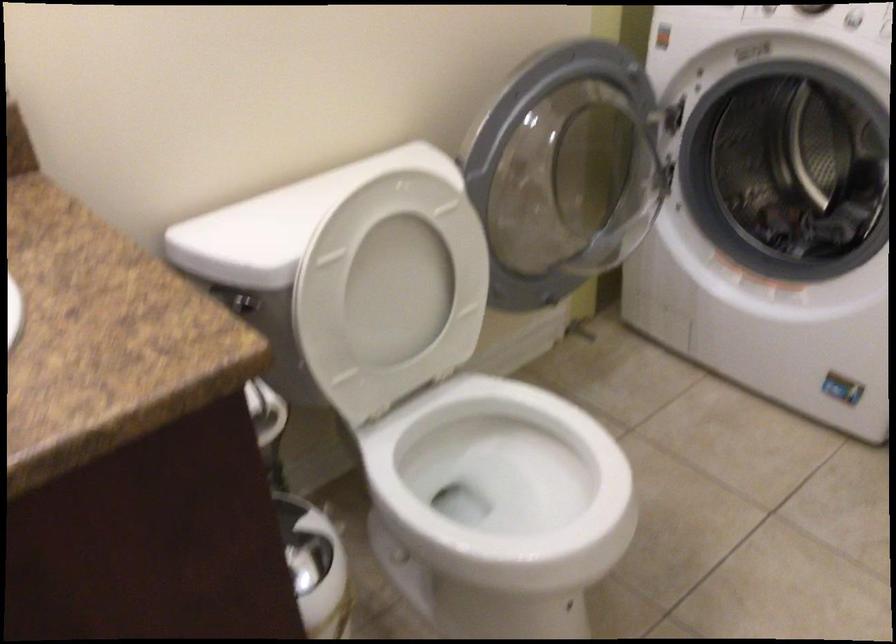
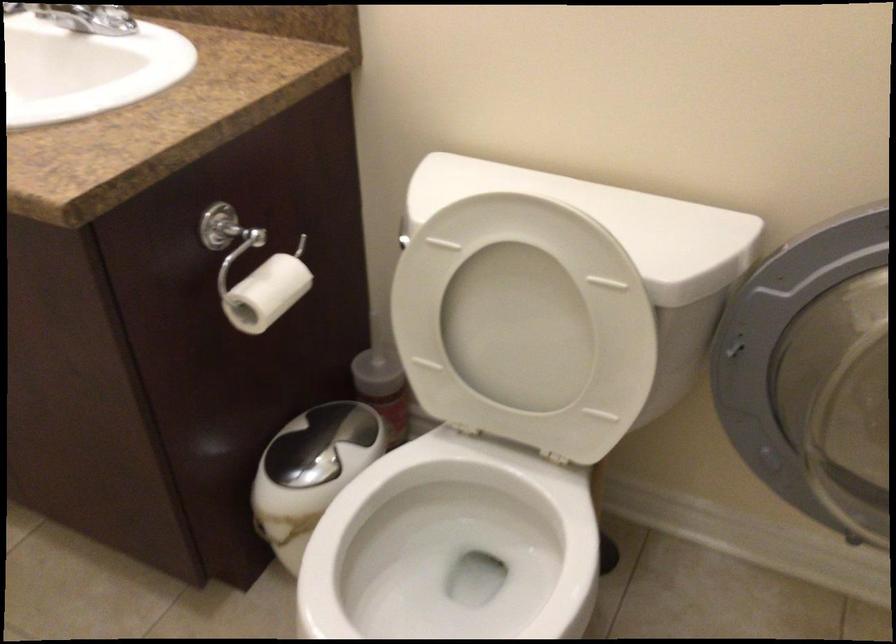
In the second image, find the point that corresponds to [383,297] in the first image.

(517, 328)